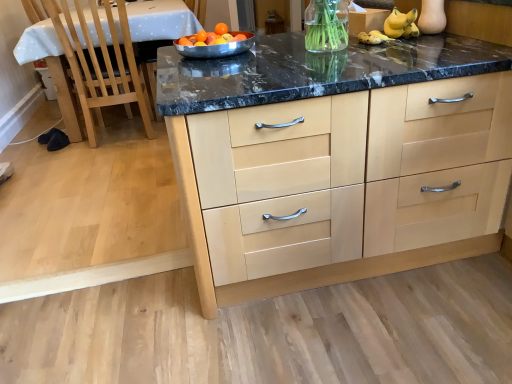
Question: From a real-world perspective, is orange matte at center positioned over light wood cabinetry at center based on gravity?

Choices:
 (A) no
 (B) yes

Answer: (B)

Question: Is orange matte at center to the left of light wood cabinetry at center from the viewer's perspective?

Choices:
 (A) no
 (B) yes

Answer: (B)

Question: Is orange matte at center behind light wood cabinetry at center?

Choices:
 (A) no
 (B) yes

Answer: (B)

Question: Is the position of orange matte at center less distant than that of light wood cabinetry at center?

Choices:
 (A) yes
 (B) no

Answer: (B)

Question: Is orange matte at center facing towards light wood cabinetry at center?

Choices:
 (A) yes
 (B) no

Answer: (B)

Question: Can you confirm if orange matte at center is taller than light wood cabinetry at center?

Choices:
 (A) no
 (B) yes

Answer: (A)

Question: From the image's perspective, would you say white glossy table at left is positioned over light wood cabinetry at center?

Choices:
 (A) no
 (B) yes

Answer: (B)

Question: Is white glossy table at left taller than light wood cabinetry at center?

Choices:
 (A) no
 (B) yes

Answer: (B)

Question: Does white glossy table at left appear on the left side of light wood cabinetry at center?

Choices:
 (A) no
 (B) yes

Answer: (B)

Question: Would you say white glossy table at left is outside light wood cabinetry at center?

Choices:
 (A) yes
 (B) no

Answer: (A)

Question: Can you confirm if white glossy table at left is smaller than light wood cabinetry at center?

Choices:
 (A) no
 (B) yes

Answer: (A)

Question: Is light wood cabinetry at center at the back of white glossy table at left?

Choices:
 (A) yes
 (B) no

Answer: (B)

Question: Is stainless steel bowl at center oriented away from orange matte at center?

Choices:
 (A) no
 (B) yes

Answer: (A)